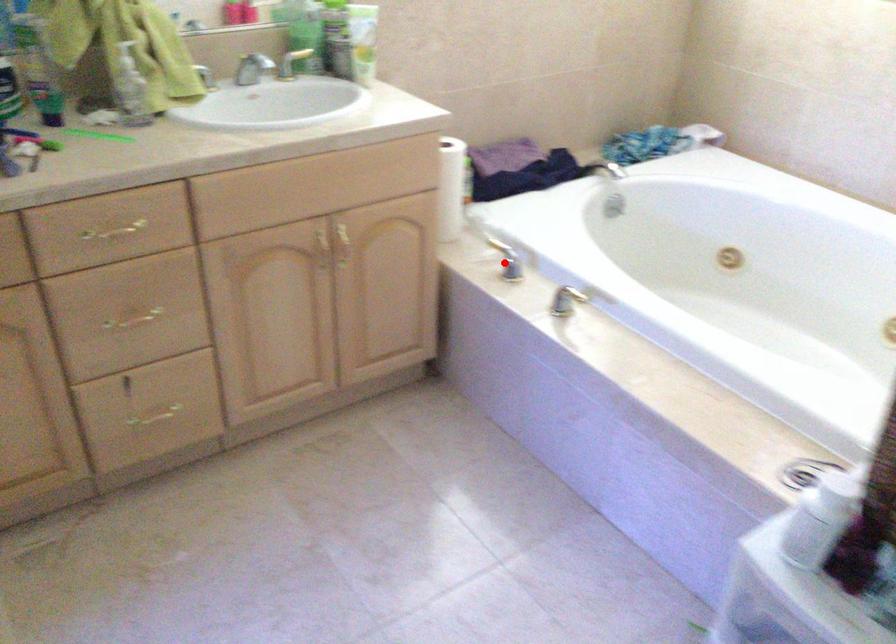
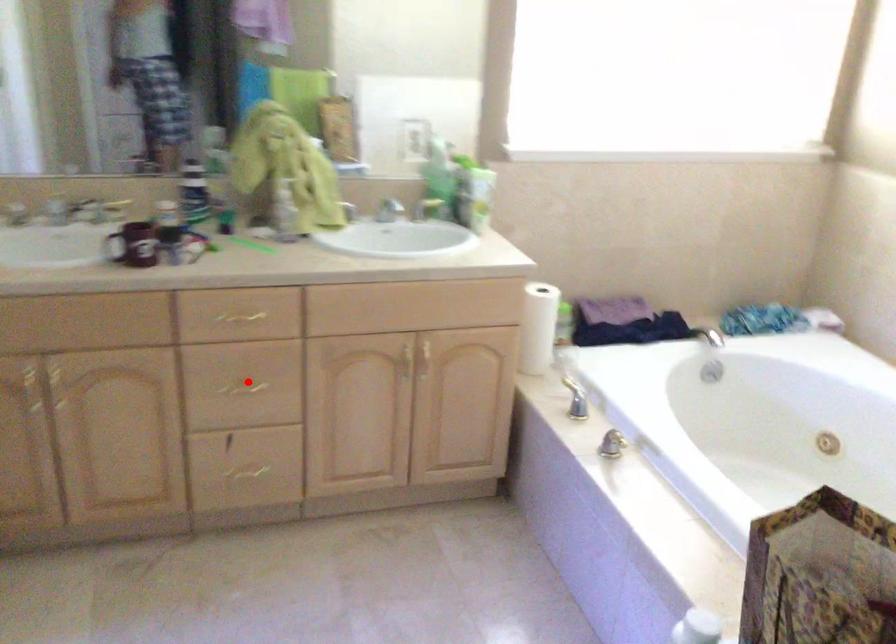
I am providing you with two images of the same scene from different viewpoints. A red point is marked on the first image and another point is marked on the second image. Does the point marked in image1 correspond to the same location as the one in image2?

No